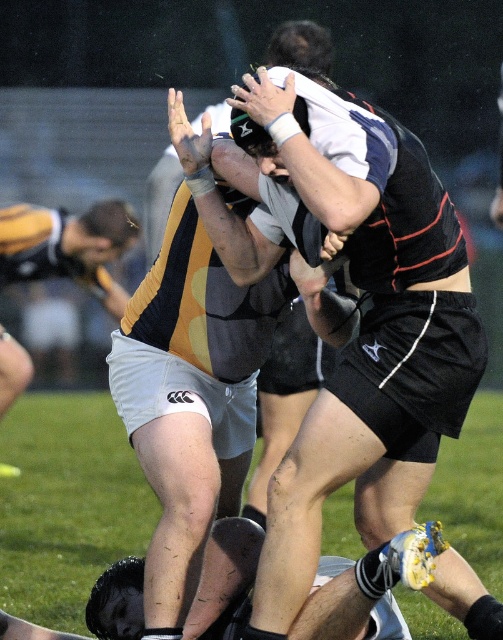
Question: Does black jersey at center appear under white matte shorts at center?

Choices:
 (A) no
 (B) yes

Answer: (B)

Question: Which point appears farthest from the camera in this image?

Choices:
 (A) (232, 326)
 (B) (395, 321)

Answer: (A)

Question: Is black jersey at center below white matte shorts at center?

Choices:
 (A) yes
 (B) no

Answer: (A)

Question: In this image, where is black jersey at center located relative to white matte shorts at center?

Choices:
 (A) right
 (B) left

Answer: (A)

Question: Which point is closer to the camera?

Choices:
 (A) black jersey at center
 (B) white matte shorts at center

Answer: (A)